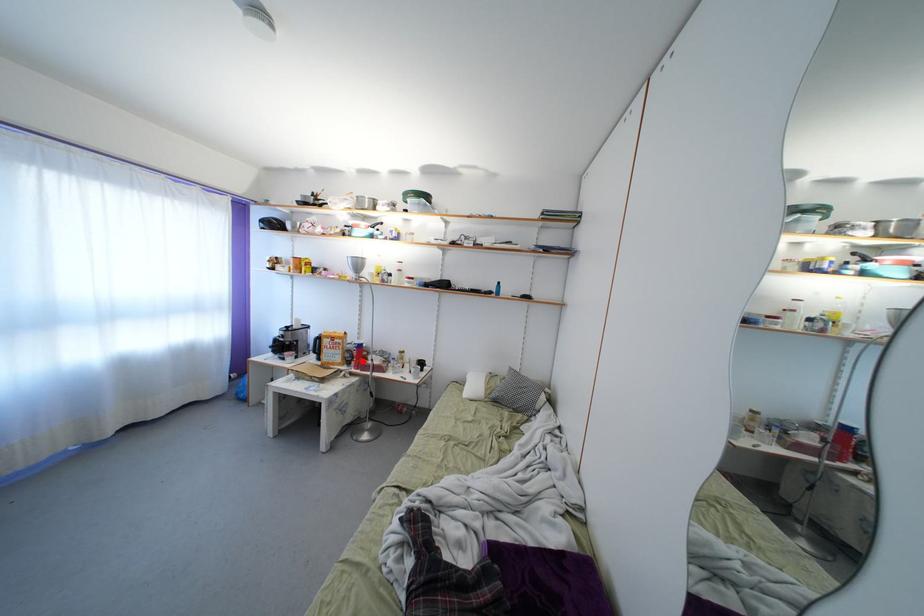
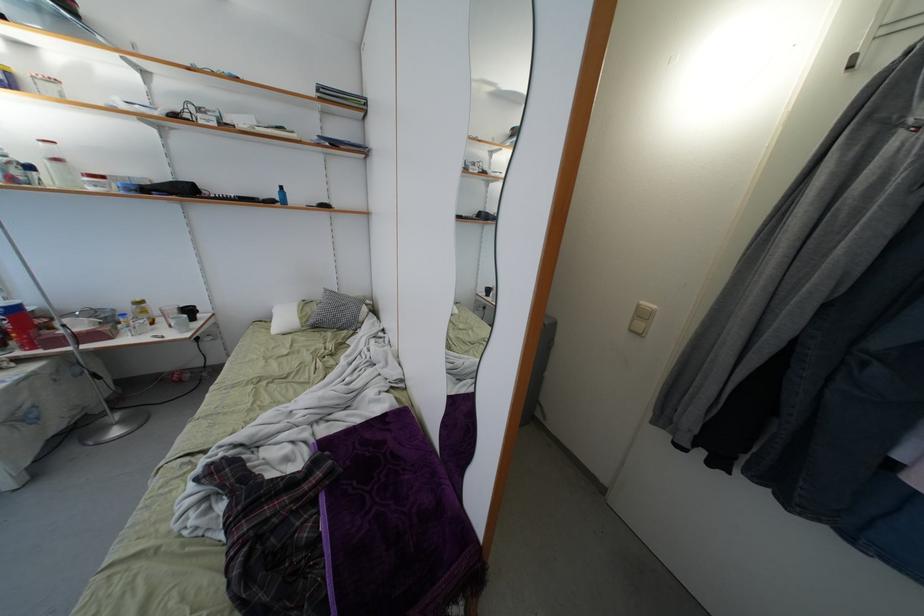
Question: A red point is marked in image1. In image2, is the corresponding 3D point closer to the camera or farther? Reply with the corresponding letter.

Choices:
 (A) The corresponding 3D point is closer.
 (B) The corresponding 3D point is farther.

Answer: (B)